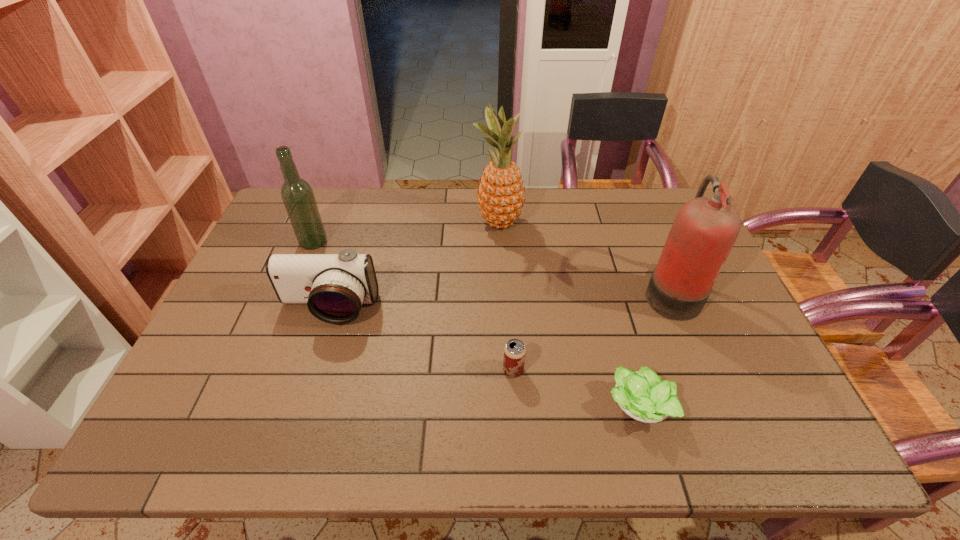
Locate an element on the screen. This screenshot has width=960, height=540. pineapple is located at coordinates (500, 196).

Locate an element on the screen. the rightmost object is located at coordinates (705, 229).

Where is `liquor`? The height and width of the screenshot is (540, 960). liquor is located at coordinates (297, 195).

Find the location of a particular element. camcorder is located at coordinates (334, 286).

Image resolution: width=960 pixels, height=540 pixels. I want to click on beer can, so click(x=514, y=351).

This screenshot has width=960, height=540. I want to click on the fifth farthest object, so click(514, 351).

Locate an element on the screen. The width and height of the screenshot is (960, 540). the shortest object is located at coordinates (642, 395).

The image size is (960, 540). What are the coordinates of `the nearest object` in the screenshot? It's located at pyautogui.click(x=642, y=395).

This screenshot has height=540, width=960. What are the coordinates of `vacant space located on the front of the pineapple` in the screenshot? It's located at (503, 298).

This screenshot has height=540, width=960. What are the coordinates of `free space located at the nozzle of the fire extinguisher` in the screenshot? It's located at (590, 292).